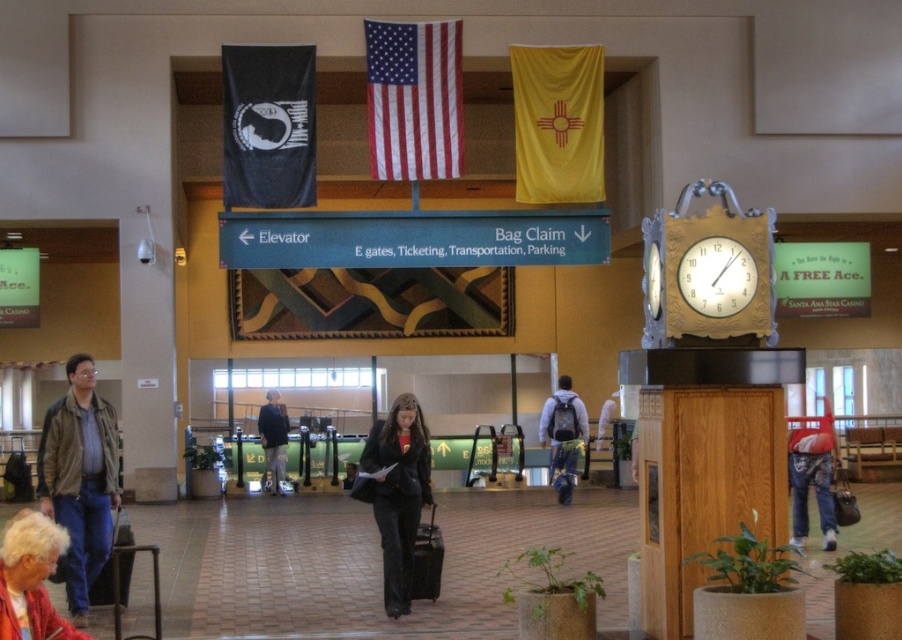
Question: Which is nearer to the dark gray suit at center?

Choices:
 (A) black fabric suitcase at lower left
 (B) dark blue suit at center
 (C) black fabric banner at upper left

Answer: (A)

Question: Is the position of dark gray suit at center more distant than that of light brown leather jacket at lower left?

Choices:
 (A) no
 (B) yes

Answer: (B)

Question: Does dark gray suit at center appear on the right side of light brown leather jacket at lower left?

Choices:
 (A) no
 (B) yes

Answer: (B)

Question: Observing the image, what is the correct spatial positioning of gold ornate clock at upper right in reference to black fabric banner at upper left?

Choices:
 (A) right
 (B) left

Answer: (A)

Question: Among these objects, which one is nearest to the camera?

Choices:
 (A) gold textured clock at upper center
 (B) american flag at center
 (C) dark gray suit at center
 (D) dark blue suit at center

Answer: (A)

Question: Which of the following is the closest to the observer?

Choices:
 (A) (97, 582)
 (B) (8, 602)
 (C) (272, 100)

Answer: (B)